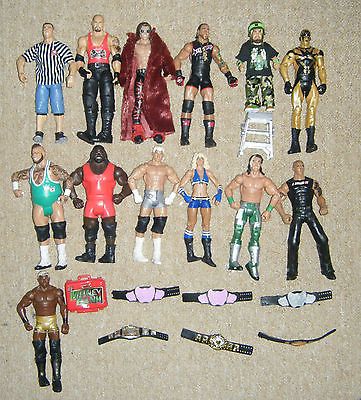
What are the coordinates of `toy wrestling belts` in the screenshot? It's located at (147, 289), (137, 332), (219, 296), (217, 342), (298, 300), (298, 343).